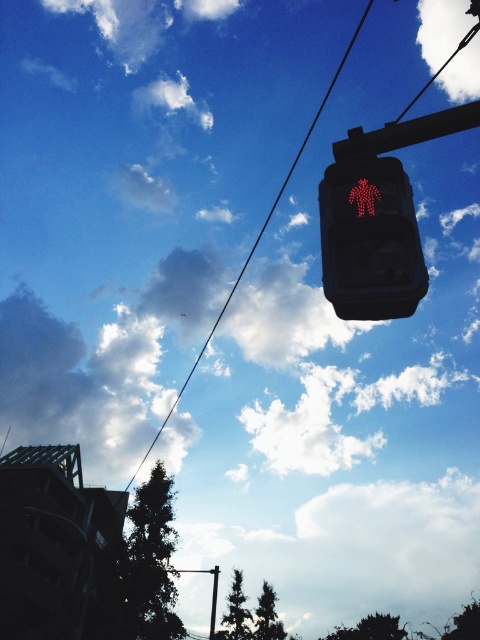
Based on the scene description, can you determine if the black wire at upper center is wider than the metallic pole at upper center?

The black wire at upper center might be wider than metallic pole at upper center according to the description.

You are a bird flying above the scene. You see the metallic pole at center and the metallic pole at upper center. Which pole is closer to your left side as you face the scene?

The metallic pole at center is to the left of metallic pole at upper center, so when facing the scene, the metallic pole at center is closer to your left side.

You are a drone operator trying to fly a drone between the red led pedestrian at upper center and the metallic pole at upper center. The drone has a wingspan of 0.5 meters. Can the drone safely pass through the gap between them?

The distance between the red led pedestrian at upper center and the metallic pole at upper center is 81.02 meters, so yes, the drone can safely pass through the gap between them since the gap is much wider than the drone wingspan.